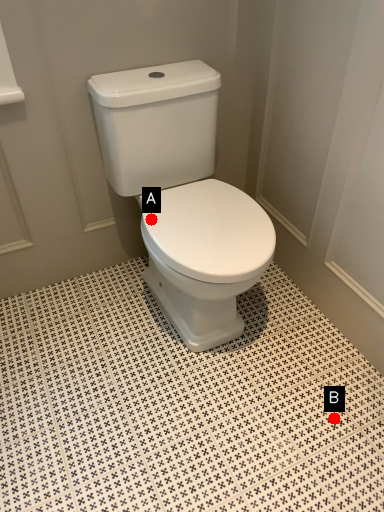
Question: Two points are circled on the image, labeled by A and B beside each circle. Which point is closer to the camera?

Choices:
 (A) A is closer
 (B) B is closer

Answer: (A)